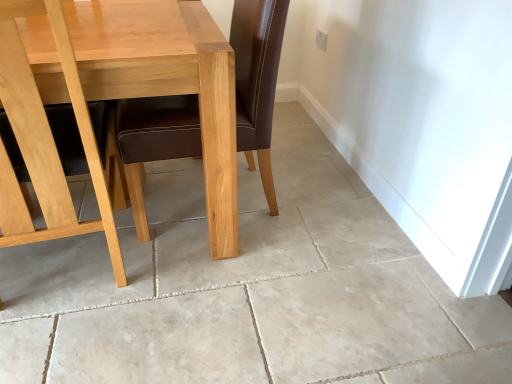
Identify the location of vacant area that lies between light brown wood chair at left and light brown wood table at center. The width and height of the screenshot is (512, 384). (170, 284).